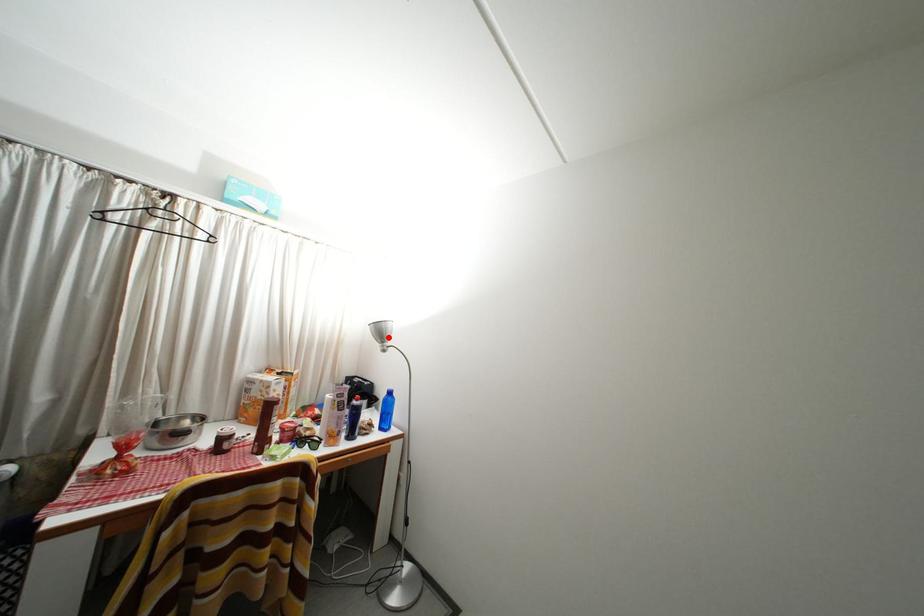
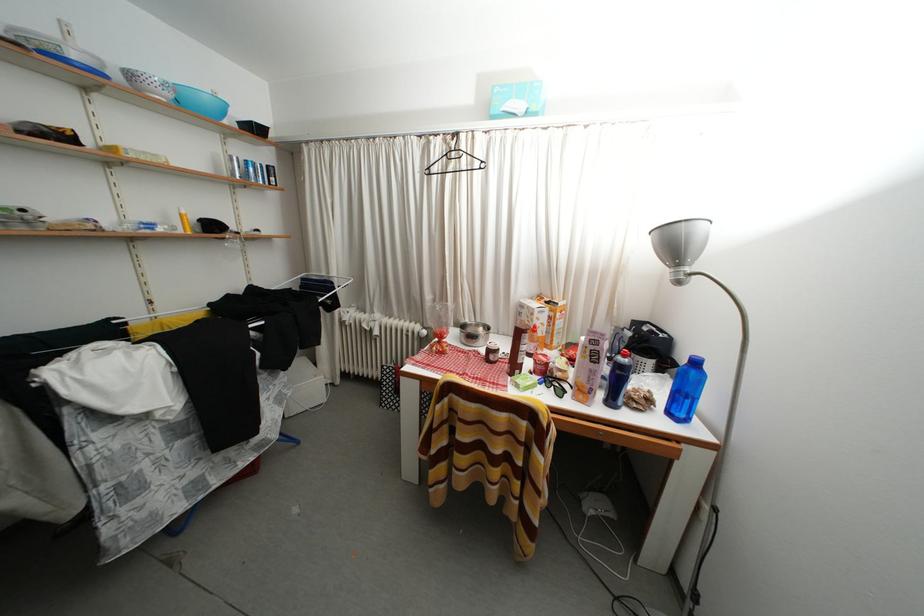
In the second image, find the point that corresponds to the highlighted location in the first image.

(681, 251)